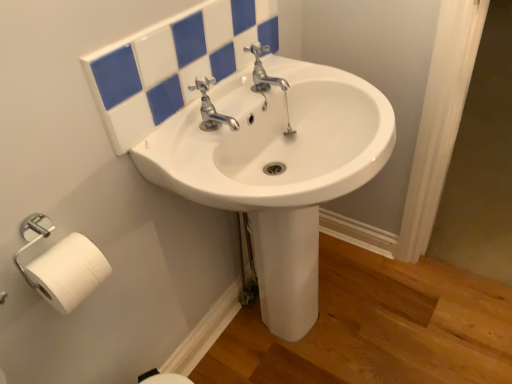
Image resolution: width=512 pixels, height=384 pixels. What do you see at coordinates (277, 168) in the screenshot?
I see `white glossy sink at center` at bounding box center [277, 168].

Locate an element on the screen. white glossy sink at center is located at coordinates (277, 168).

Where is `white matte toilet paper at lower left`? The image size is (512, 384). white matte toilet paper at lower left is located at coordinates [68, 272].

Would you say white matte toilet paper at lower left is a long distance from white glossy mirror at upper center?

No, there isn't a large distance between white matte toilet paper at lower left and white glossy mirror at upper center.

Which of these two, white matte toilet paper at lower left or white glossy mirror at upper center, stands taller?

white glossy mirror at upper center is taller.

This screenshot has width=512, height=384. In order to click on toilet paper on the left of the white glossy mirror at upper center in this screenshot , I will do `click(68, 272)`.

Is white matte toilet paper at lower left facing away from white glossy mirror at upper center?

No.

Can you confirm if chrome metallic faucet at center is wider than white glossy mirror at upper center?

Yes.

From a real-world perspective, which is physically below, chrome metallic faucet at center or white glossy mirror at upper center?

In real-world perspective, chrome metallic faucet at center is lower.

From the image's perspective, which is above, chrome metallic faucet at center or white glossy mirror at upper center?

white glossy mirror at upper center.

Considering the relative sizes of white glossy sink at center and chrome metallic faucet at center in the image provided, is white glossy sink at center bigger than chrome metallic faucet at center?

Indeed, white glossy sink at center has a larger size compared to chrome metallic faucet at center.

Is white glossy sink at center located outside chrome metallic faucet at center?

Yes, white glossy sink at center is located beyond the bounds of chrome metallic faucet at center.

From the image's perspective, which object appears higher, white glossy sink at center or chrome metallic faucet at center?

chrome metallic faucet at center, from the image's perspective.

Is white glossy sink at center at the right side of chrome metallic faucet at center?

Correct, you'll find white glossy sink at center to the right of chrome metallic faucet at center.

Can you see chrome metallic faucet at center touching white glossy sink at center?

No, chrome metallic faucet at center is not in contact with white glossy sink at center.

Is chrome metallic faucet at center taller than white glossy sink at center?

No, chrome metallic faucet at center is not taller than white glossy sink at center.

Which object is positioned more to the right, chrome metallic faucet at center or white glossy sink at center?

white glossy sink at center.

Which of these two, chrome metallic faucet at center or white glossy sink at center, is smaller?

With smaller size is chrome metallic faucet at center.

Is white glossy sink at center beside white matte toilet paper at lower left?

There is a gap between white glossy sink at center and white matte toilet paper at lower left.

From the image's perspective, would you say white glossy sink at center is positioned over white matte toilet paper at lower left?

Actually, white glossy sink at center appears below white matte toilet paper at lower left in the image.

Is white glossy sink at center positioned in front of white matte toilet paper at lower left?

Yes, it is.

I want to click on toilet paper that appears behind the white glossy sink at center, so click(x=68, y=272).

The width and height of the screenshot is (512, 384). Identify the location of toilet paper located below the chrome metallic faucet at center (from the image's perspective). (68, 272).

Is chrome metallic faucet at center at the right side of white matte toilet paper at lower left?

Yes, chrome metallic faucet at center is to the right of white matte toilet paper at lower left.

Considering the positions of point (215, 124) and point (89, 255), is point (215, 124) closer or farther from the camera than point (89, 255)?

Clearly, point (215, 124) is more distant from the camera than point (89, 255).

Can you confirm if white glossy mirror at upper center is smaller than white glossy sink at center?

Yes.

The height and width of the screenshot is (384, 512). In order to click on mirror above the white glossy sink at center (from the image's perspective) in this screenshot , I will do `click(173, 63)`.

Is point (170, 63) positioned behind point (312, 88)?

No, (170, 63) is closer to viewer.

Is white glossy mirror at upper center positioned in front of white glossy sink at center?

No, the depth of white glossy mirror at upper center is greater than that of white glossy sink at center.

Locate an element on the screen. Image resolution: width=512 pixels, height=384 pixels. toilet paper below the white glossy mirror at upper center (from the image's perspective) is located at coordinates (68, 272).

Where is `tap that is under the white glossy mirror at upper center (from a real-world perspective)`? Image resolution: width=512 pixels, height=384 pixels. tap that is under the white glossy mirror at upper center (from a real-world perspective) is located at coordinates (211, 108).

In the scene shown: Estimate the real-world distances between objects in this image. Which object is further from white glossy mirror at upper center, chrome metallic faucet at center or white matte toilet paper at lower left?

white matte toilet paper at lower left is positioned further to the anchor white glossy mirror at upper center.

Considering their positions, is white glossy mirror at upper center positioned further to chrome metallic faucet at center than white matte toilet paper at lower left?

white matte toilet paper at lower left lies further to chrome metallic faucet at center than the other object.

In the scene shown: Considering their positions, is chrome metallic faucet at center positioned further to white matte toilet paper at lower left than white glossy mirror at upper center?

Based on the image, chrome metallic faucet at center appears to be further to white matte toilet paper at lower left.

Looking at the image, which one is located further to white glossy sink at center, white glossy mirror at upper center or chrome metallic faucet at center?

Based on the image, chrome metallic faucet at center appears to be further to white glossy sink at center.

Considering their positions, is white glossy sink at center positioned further to chrome metallic faucet at center than white matte toilet paper at lower left?

white matte toilet paper at lower left lies further to chrome metallic faucet at center than the other object.

Based on their spatial positions, is chrome metallic faucet at center or white glossy sink at center further from white matte toilet paper at lower left?

Based on the image, white glossy sink at center appears to be further to white matte toilet paper at lower left.

When comparing their distances from white matte toilet paper at lower left, does white glossy sink at center or chrome metallic faucet at center seem closer?

Among the two, chrome metallic faucet at center is located nearer to white matte toilet paper at lower left.

Based on the photo, looking at the image, which one is located further to white glossy mirror at upper center, chrome metallic faucet at center or white glossy sink at center?

Among the two, white glossy sink at center is located further to white glossy mirror at upper center.

Identify the location of toilet paper between white glossy mirror at upper center and white glossy sink at center in the up-down direction. This screenshot has width=512, height=384. (68, 272).

You are a GUI agent. You are given a task and a screenshot of the screen. Output one action in this format:
    pyautogui.click(x=<x>, y=<y>)
    Task: Click on the tap between white glossy mirror at upper center and white matte toilet paper at lower left vertically
    This screenshot has width=512, height=384.
    Given the screenshot: What is the action you would take?
    click(211, 108)

Identify the location of tap that lies between white glossy mirror at upper center and white glossy sink at center from top to bottom. This screenshot has height=384, width=512. (211, 108).

You are a GUI agent. You are given a task and a screenshot of the screen. Output one action in this format:
    pyautogui.click(x=<x>, y=<y>)
    Task: Click on the tap located between white matte toilet paper at lower left and white glossy sink at center in the left-right direction
    
    Given the screenshot: What is the action you would take?
    pyautogui.click(x=211, y=108)